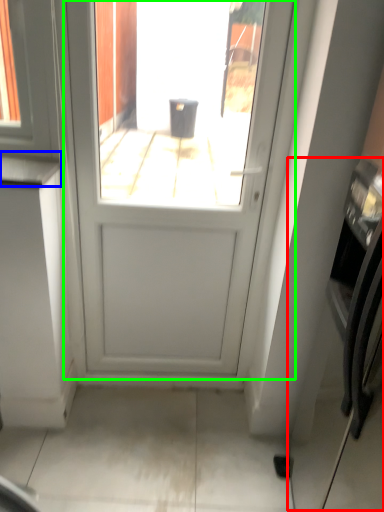
Question: Based on their relative distances, which object is nearer to oven (highlighted by a red box)? Choose from counter top (highlighted by a blue box) and door (highlighted by a green box).

Choices:
 (A) counter top
 (B) door

Answer: (B)